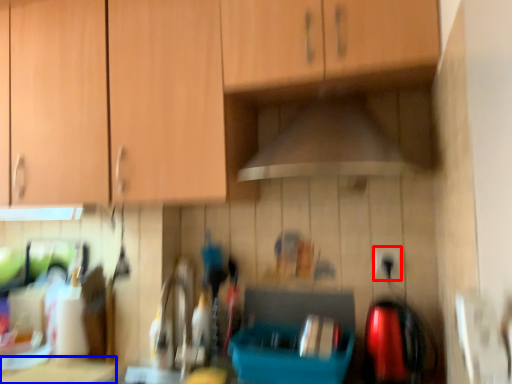
Question: Among these objects, which one is farthest to the camera, electric outlet (highlighted by a red box) or counter top (highlighted by a blue box)?

Choices:
 (A) electric outlet
 (B) counter top

Answer: (A)